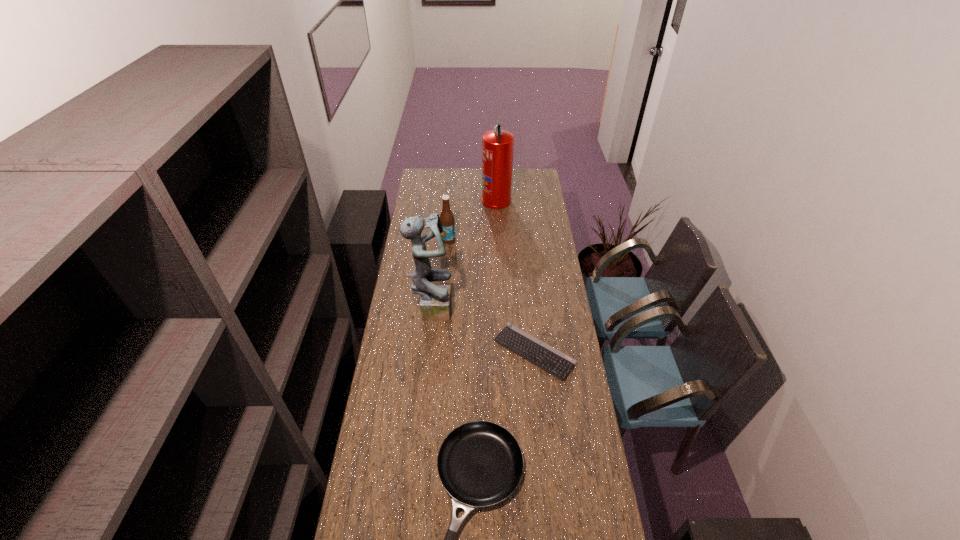
You are a GUI agent. You are given a task and a screenshot of the screen. Output one action in this format:
    pyautogui.click(x=<x>, y=<y>)
    Task: Click on the fire extinguisher
    Image resolution: width=960 pixels, height=540 pixels.
    Given the screenshot: What is the action you would take?
    pyautogui.click(x=497, y=145)

Where is `sculpture`? The height and width of the screenshot is (540, 960). sculpture is located at coordinates (435, 303).

Where is `the second farthest object`? the second farthest object is located at coordinates pos(447,220).

At what (x,y) coordinates should I click in order to perform the action: click on the third tallest object. Please return your answer as a coordinate pair (x, y). The image size is (960, 540). Looking at the image, I should click on (447, 220).

This screenshot has width=960, height=540. Find the location of `the second nearest object`. the second nearest object is located at coordinates (555, 362).

Where is `computer keyboard`? The width and height of the screenshot is (960, 540). computer keyboard is located at coordinates (555, 362).

Find the location of a particular element. vacant region located on the instruction side of the fire extinguisher is located at coordinates (435, 200).

Image resolution: width=960 pixels, height=540 pixels. In order to click on vacant space located 0.270m on the instruction side of the fire extinguisher in this screenshot , I will do `click(438, 200)`.

The image size is (960, 540). Identify the location of free space located 0.120m on the instruction side of the fire extinguisher. (462, 200).

Locate an element on the screen. The height and width of the screenshot is (540, 960). vacant region located on the face of the third farthest object is located at coordinates (489, 307).